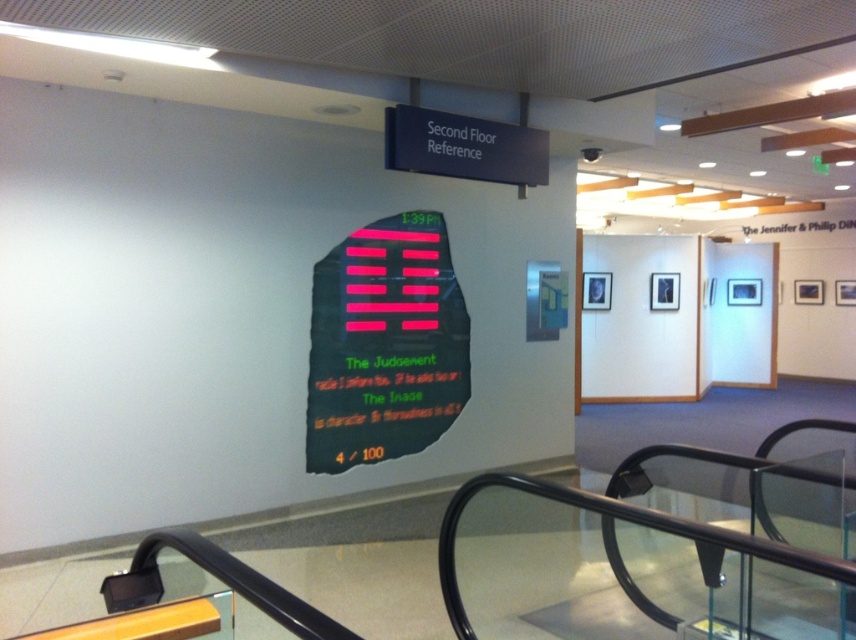
You are standing on the second floor of a library and want to locate the pink matte sign at center. According to the scene description, where should you look relative to the curved glass railing?

The pink matte sign at center is located at the 2D coordinates point (384, 344), which is at the center of the scene. Since the curved glass railing is in the foreground, you should look towards the middle area of the room, away from the railing, to find the pink matte sign at center.

You are a visitor at the museum and want to read both the pink matte sign at center and the black plastic sign at upper center. Which sign should you move closer to first to read the text comfortably?

The pink matte sign at center is larger in size than the black plastic sign at upper center, so you can read the pink matte sign at center from a farther distance. Therefore, you should move closer to the black plastic sign at upper center first to read its text comfortably.

You are standing on the second floor of a building and want to read the pink matte sign at center and the black plastic sign at upper center. Which sign do you need to look up at first?

The black plastic sign at upper center is located above the pink matte sign at center, so you should look up at the black plastic sign at upper center first before looking down to read the pink matte sign at center.